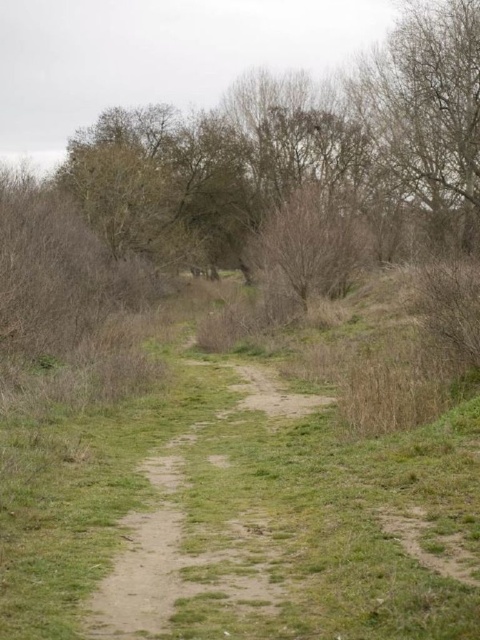
Question: Is green grassy at center above dirt/grass path at center?

Choices:
 (A) no
 (B) yes

Answer: (B)

Question: Is green grassy at center thinner than dirt/grass path at center?

Choices:
 (A) no
 (B) yes

Answer: (A)

Question: Which of the following is the farthest from the observer?

Choices:
 (A) (297, 481)
 (B) (158, 593)

Answer: (A)

Question: Does green grassy at center have a lesser width compared to dirt/grass path at center?

Choices:
 (A) no
 (B) yes

Answer: (A)

Question: Among these points, which one is farthest from the camera?

Choices:
 (A) (132, 632)
 (B) (94, 625)

Answer: (B)

Question: Which point is farther to the camera?

Choices:
 (A) (190, 387)
 (B) (146, 572)

Answer: (A)